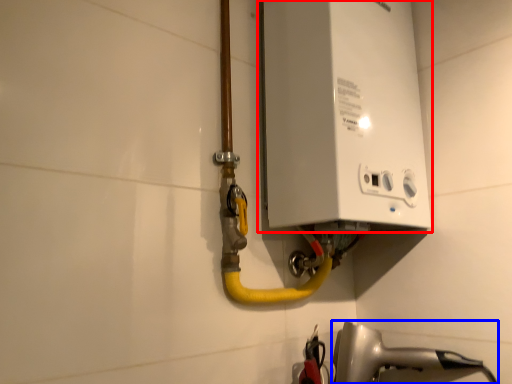
Question: Among these objects, which one is farthest to the camera, appliance (highlighted by a red box) or plumbing fixture (highlighted by a blue box)?

Choices:
 (A) appliance
 (B) plumbing fixture

Answer: (B)